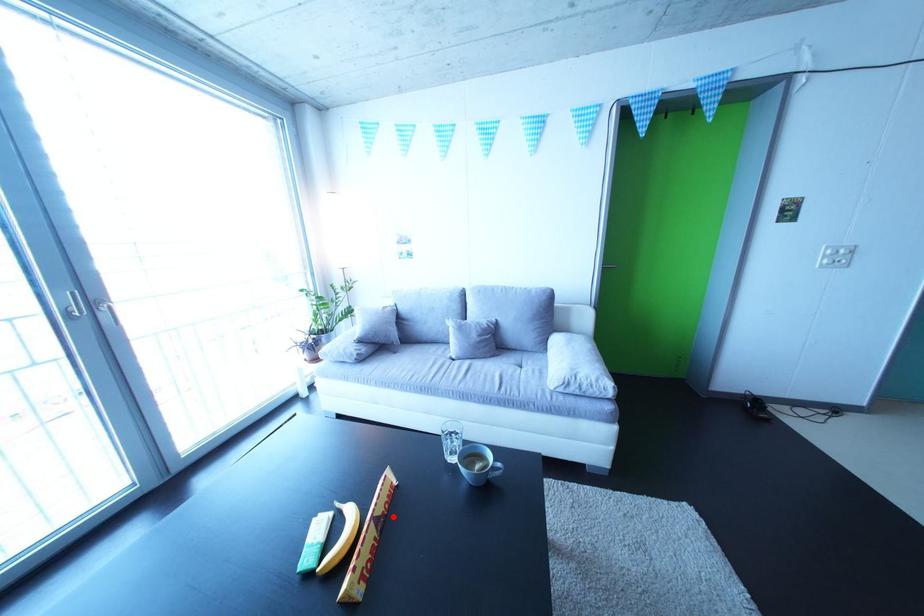
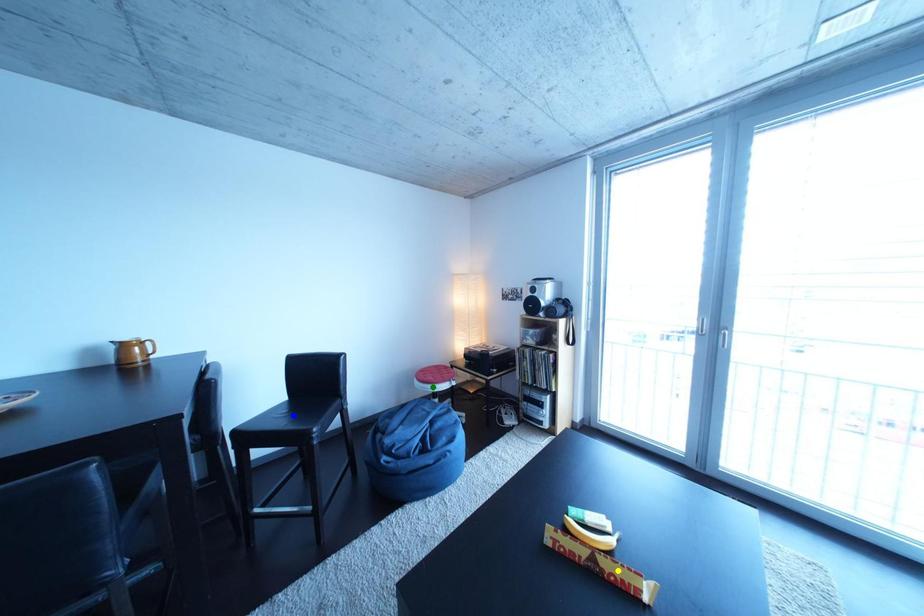
Question: I am providing you with two images of the same scene from different viewpoints. A red point is marked on the first image. You are given multiple points on the second image. Which spot in image 2 lines up with the point in image 1?

Choices:
 (A) yellow point
 (B) green point
 (C) blue point

Answer: (A)